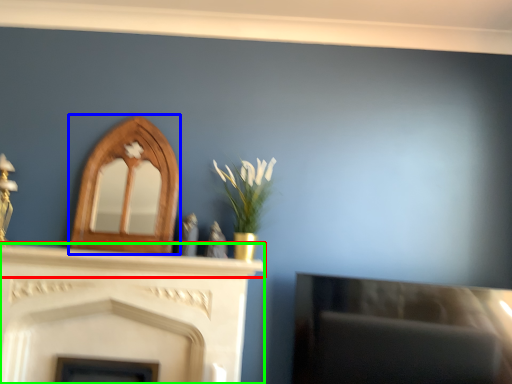
Question: Which is farther away from mantle (highlighted by a red box)? fireplace (highlighted by a blue box) or fireplace (highlighted by a green box)?

Choices:
 (A) fireplace
 (B) fireplace

Answer: (A)